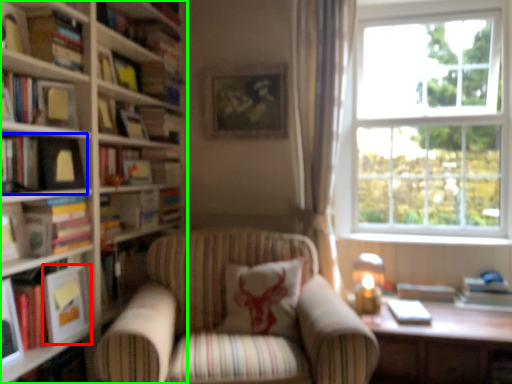
Question: Based on their relative distances, which object is farther from paperback book (highlighted by a red box)? Choose from book (highlighted by a blue box) and book (highlighted by a green box).

Choices:
 (A) book
 (B) book

Answer: (A)